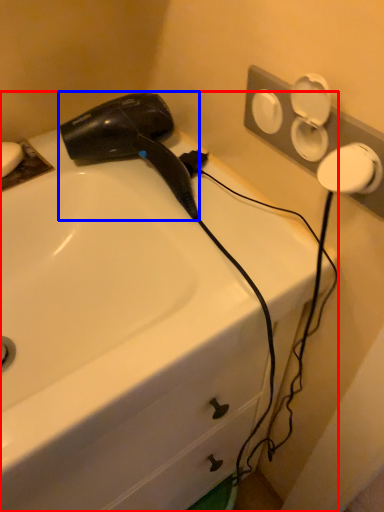
Question: Which object appears closest to the camera in this image, sink (highlighted by a red box) or hair drier (highlighted by a blue box)?

Choices:
 (A) sink
 (B) hair drier

Answer: (A)